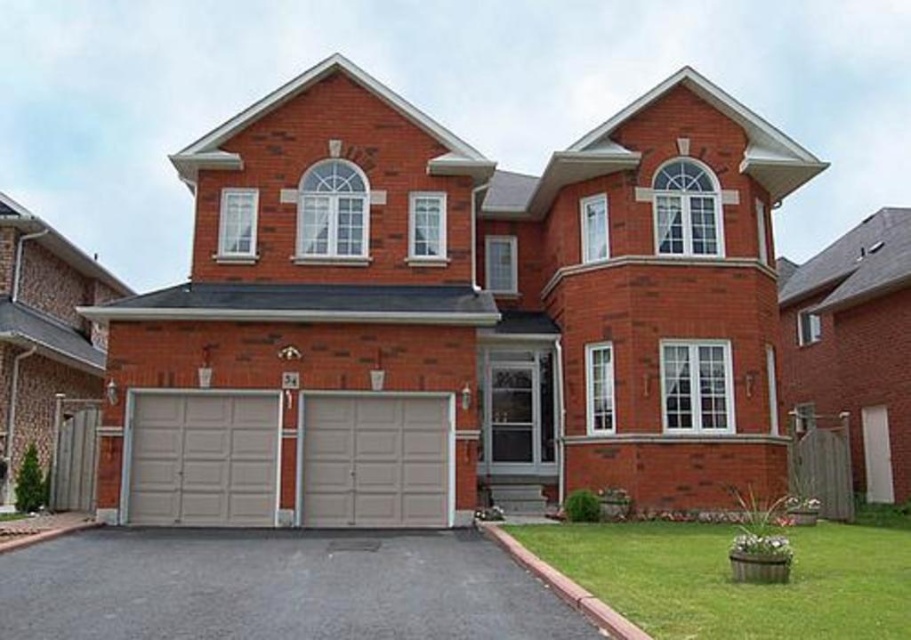
Who is positioned more to the left, beige textured garage door at center or matte gray garage door at center?

beige textured garage door at center is more to the left.

Who is more forward, (202, 435) or (361, 477)?

Point (361, 477)

The image size is (911, 640). In order to click on beige textured garage door at center in this screenshot , I will do pyautogui.click(x=200, y=458).

Can you confirm if black asphalt driveway at center is positioned above matte gray garage door at center?

No, black asphalt driveway at center is not above matte gray garage door at center.

Between black asphalt driveway at center and matte gray garage door at center, which one is positioned lower?

black asphalt driveway at center is below.

The width and height of the screenshot is (911, 640). I want to click on black asphalt driveway at center, so click(x=275, y=588).

Is green grass at lower right thinner than matte gray garage door at center?

No.

Is point (720, 609) closer to camera compared to point (354, 484)?

Yes, point (720, 609) is in front of point (354, 484).

The height and width of the screenshot is (640, 911). Identify the location of green grass at lower right. (734, 582).